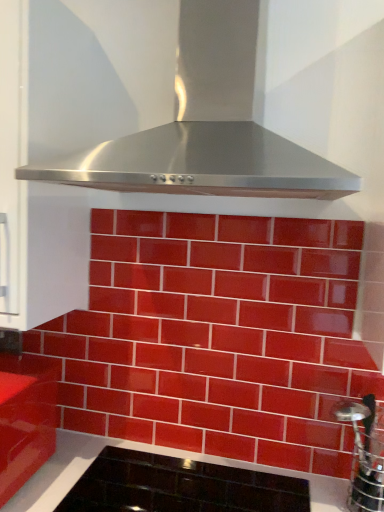
The image size is (384, 512). Describe the element at coordinates (216, 337) in the screenshot. I see `glossy ceramic tiles at center` at that location.

Find the location of a particular element. The width and height of the screenshot is (384, 512). glossy ceramic tiles at center is located at coordinates (216, 337).

Identify the location of black glass cooktop at lower center. The image size is (384, 512). (179, 486).

What are the coordinates of `glossy red cabinet at lower left` in the screenshot? It's located at (25, 419).

In the scene shown: Considering the positions of objects glossy ceramic tiles at center and glossy red cabinet at lower left in the image provided, who is behind, glossy ceramic tiles at center or glossy red cabinet at lower left?

glossy ceramic tiles at center.

Consider the image. Is glossy ceramic tiles at center located outside glossy red cabinet at lower left?

Absolutely, glossy ceramic tiles at center is external to glossy red cabinet at lower left.

From a real-world perspective, which is physically below, glossy ceramic tiles at center or glossy red cabinet at lower left?

In real-world perspective, glossy red cabinet at lower left is lower.

Between black glass cooktop at lower center and stainless steel range hood at upper center, which one has more height?

Standing taller between the two is stainless steel range hood at upper center.

At what (x,y) coordinates should I click in order to perform the action: click on home appliance lying above the black glass cooktop at lower center (from the image's perspective). Please return your answer as a coordinate pair (x, y). Looking at the image, I should click on (205, 134).

Considering the relative positions of black glass cooktop at lower center and stainless steel range hood at upper center in the image provided, is black glass cooktop at lower center to the right of stainless steel range hood at upper center from the viewer's perspective?

No.

Can you tell me how much black glass cooktop at lower center and stainless steel range hood at upper center differ in facing direction?

There is a 0.706-degree angle between the facing directions of black glass cooktop at lower center and stainless steel range hood at upper center.

Would you say black glass cooktop at lower center is outside glossy ceramic tiles at center?

Yes, black glass cooktop at lower center is located beyond the bounds of glossy ceramic tiles at center.

The height and width of the screenshot is (512, 384). What are the coordinates of `brickwork above the black glass cooktop at lower center (from the image's perspective)` in the screenshot? It's located at [x=216, y=337].

Considering the relative sizes of black glass cooktop at lower center and glossy ceramic tiles at center in the image provided, is black glass cooktop at lower center smaller than glossy ceramic tiles at center?

Yes.

Looking at this image, based on their positions, is stainless steel range hood at upper center located to the left or right of glossy ceramic tiles at center?

From the image, it's evident that stainless steel range hood at upper center is to the right of glossy ceramic tiles at center.

Is stainless steel range hood at upper center not inside glossy ceramic tiles at center?

stainless steel range hood at upper center is positioned outside glossy ceramic tiles at center.

I want to click on brickwork that is below the stainless steel range hood at upper center (from the image's perspective), so (216, 337).

Considering the points (79, 164) and (29, 344), which point is behind, point (79, 164) or point (29, 344)?

The point (29, 344) is more distant.

Locate an element on the screen. The height and width of the screenshot is (512, 384). stainless steel behind the stainless steel range hood at upper center is located at coordinates (365, 455).

Is stainless steel range hood at upper center positioned with its back to stainless steel at right?

That's not correct — stainless steel range hood at upper center is not looking away from stainless steel at right.

Based on their sizes in the image, would you say stainless steel range hood at upper center is bigger or smaller than stainless steel at right?

Considering their sizes, stainless steel range hood at upper center takes up more space than stainless steel at right.

Is glossy ceramic tiles at center located outside stainless steel at right?

Indeed, glossy ceramic tiles at center is completely outside stainless steel at right.

From the picture: Looking at their sizes, would you say glossy ceramic tiles at center is wider or thinner than stainless steel at right?

In the image, glossy ceramic tiles at center appears to be more narrow than stainless steel at right.

From the image's perspective, is glossy ceramic tiles at center above or below stainless steel at right?

glossy ceramic tiles at center is situated higher than stainless steel at right in the image.

Between glossy ceramic tiles at center and stainless steel at right, which one has more height?

glossy ceramic tiles at center.

Between stainless steel at right and black glass cooktop at lower center, which one has larger width?

black glass cooktop at lower center is wider.

Is stainless steel at right inside the boundaries of black glass cooktop at lower center, or outside?

stainless steel at right lies outside black glass cooktop at lower center.

Between stainless steel at right and black glass cooktop at lower center, which one has smaller size?

stainless steel at right.

Is stainless steel at right shorter than black glass cooktop at lower center?

No.

You are a GUI agent. You are given a task and a screenshot of the screen. Output one action in this format:
    pyautogui.click(x=<x>, y=<y>)
    Task: Click on the cabinetry on the left of glossy ceramic tiles at center
    
    Given the screenshot: What is the action you would take?
    pyautogui.click(x=25, y=419)

Identify the location of appliance behind the stainless steel range hood at upper center. (179, 486).

Based on their spatial positions, is stainless steel at right or glossy red cabinet at lower left closer to glossy ceramic tiles at center?

Based on the image, stainless steel at right appears to be nearer to glossy ceramic tiles at center.

From the image, which object appears to be farther from glossy red cabinet at lower left, stainless steel range hood at upper center or black glass cooktop at lower center?

Among the two, stainless steel range hood at upper center is located further to glossy red cabinet at lower left.

Consider the image. From the image, which object appears to be nearer to stainless steel range hood at upper center, black glass cooktop at lower center or glossy ceramic tiles at center?

glossy ceramic tiles at center.

Based on their spatial positions, is black glass cooktop at lower center or stainless steel at right further from glossy red cabinet at lower left?

stainless steel at right is positioned further to the anchor glossy red cabinet at lower left.

When comparing their distances from glossy red cabinet at lower left, does glossy ceramic tiles at center or stainless steel at right seem closer?

→ The object closer to glossy red cabinet at lower left is glossy ceramic tiles at center.

When comparing their distances from glossy ceramic tiles at center, does stainless steel at right or stainless steel range hood at upper center seem further?

stainless steel range hood at upper center.

When comparing their distances from stainless steel range hood at upper center, does glossy red cabinet at lower left or stainless steel at right seem further?

The object further to stainless steel range hood at upper center is stainless steel at right.

From the image, which object appears to be nearer to glossy red cabinet at lower left, stainless steel range hood at upper center or glossy ceramic tiles at center?

The object closer to glossy red cabinet at lower left is glossy ceramic tiles at center.

The image size is (384, 512). I want to click on stainless steel between stainless steel range hood at upper center and black glass cooktop at lower center vertically, so click(x=365, y=455).

Find the location of a particular element. brickwork between glossy red cabinet at lower left and stainless steel at right in the horizontal direction is located at coordinates tap(216, 337).

What are the coordinates of `brickwork that lies between stainless steel range hood at upper center and glossy red cabinet at lower left from top to bottom` in the screenshot? It's located at (216, 337).

Where is `brickwork between stainless steel range hood at upper center and black glass cooktop at lower center in the vertical direction`? This screenshot has height=512, width=384. brickwork between stainless steel range hood at upper center and black glass cooktop at lower center in the vertical direction is located at coordinates (216, 337).